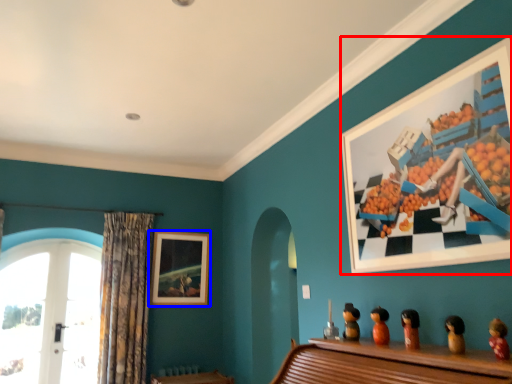
Question: Which point is further to the camera, picture frame (highlighted by a red box) or picture frame (highlighted by a blue box)?

Choices:
 (A) picture frame
 (B) picture frame

Answer: (B)